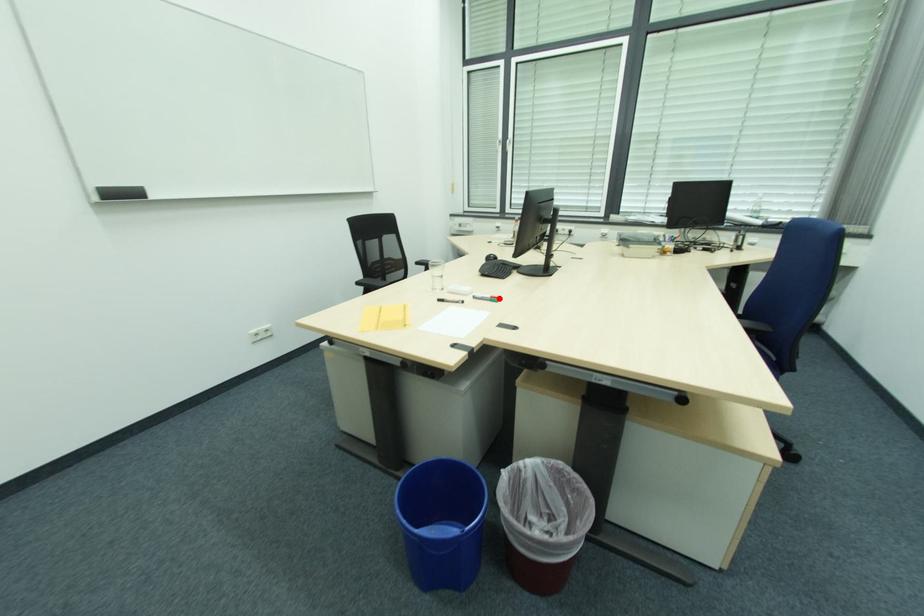
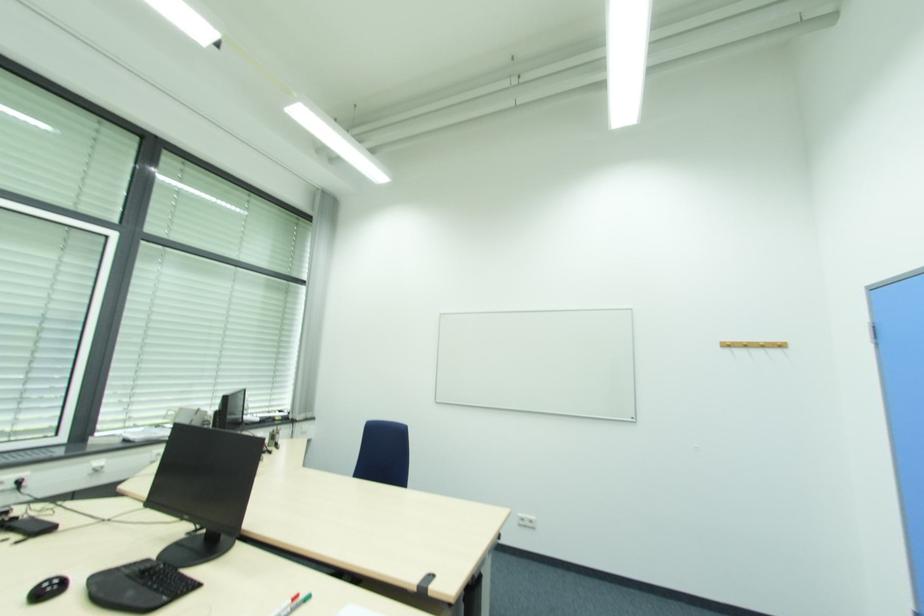
The point at the highlighted location is marked in the first image. Where is the corresponding point in the second image?

(298, 599)